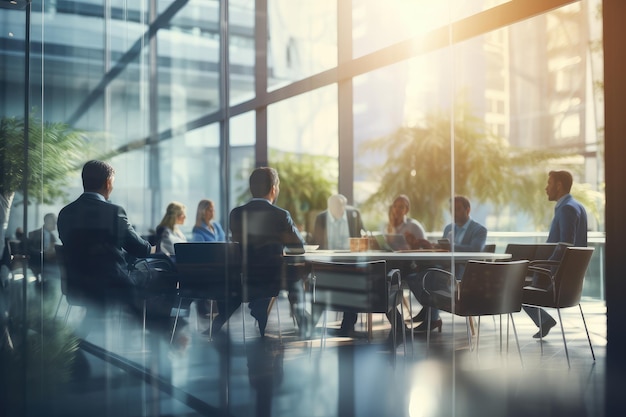
The height and width of the screenshot is (417, 626). Find the location of `first five chairs in the foreground`. first five chairs in the foreground is located at coordinates (90, 280), (201, 274), (342, 287), (486, 291), (572, 276).